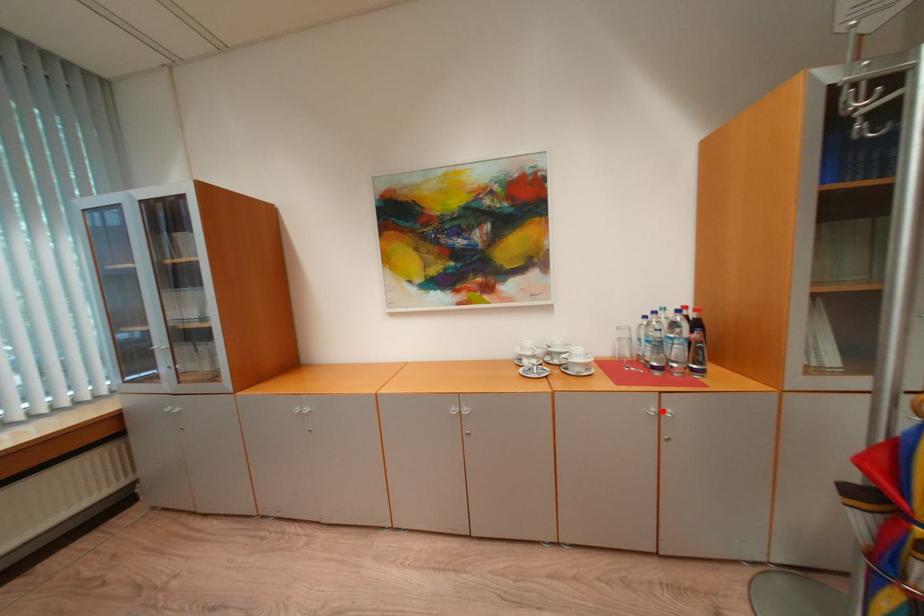
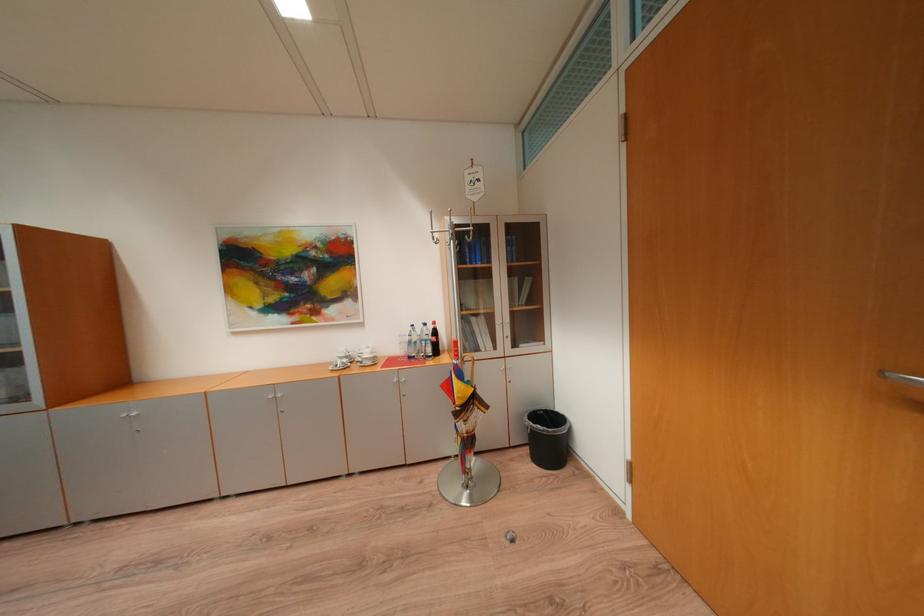
The point at the highlighted location is marked in the first image. Where is the corresponding point in the second image?

(405, 381)